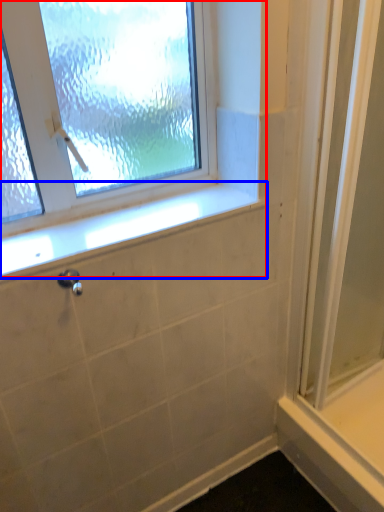
Question: Which object appears closest to the camera in this image, window (highlighted by a red box) or window sill (highlighted by a blue box)?

Choices:
 (A) window
 (B) window sill

Answer: (A)